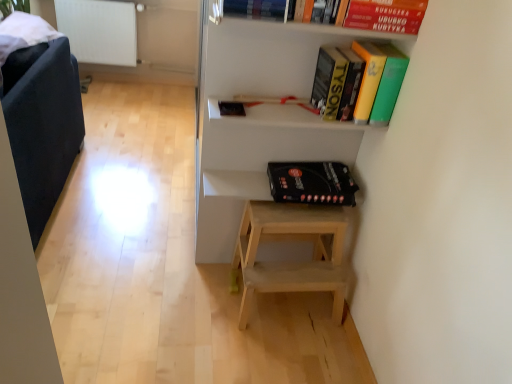
The image size is (512, 384). I want to click on free spot above black matte board game at center, the 1th paperback book in the bottom-to-top sequence (from a real-world perspective), so click(309, 170).